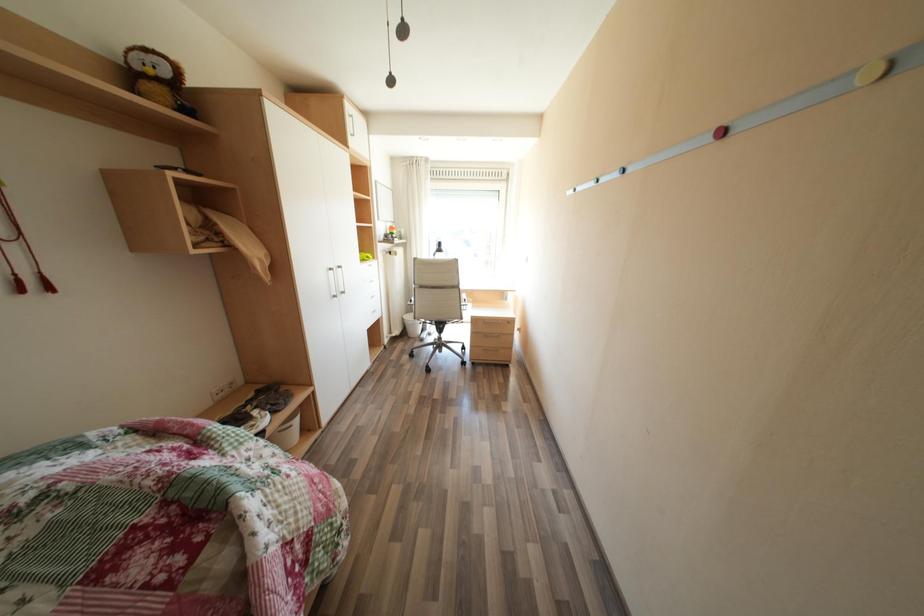
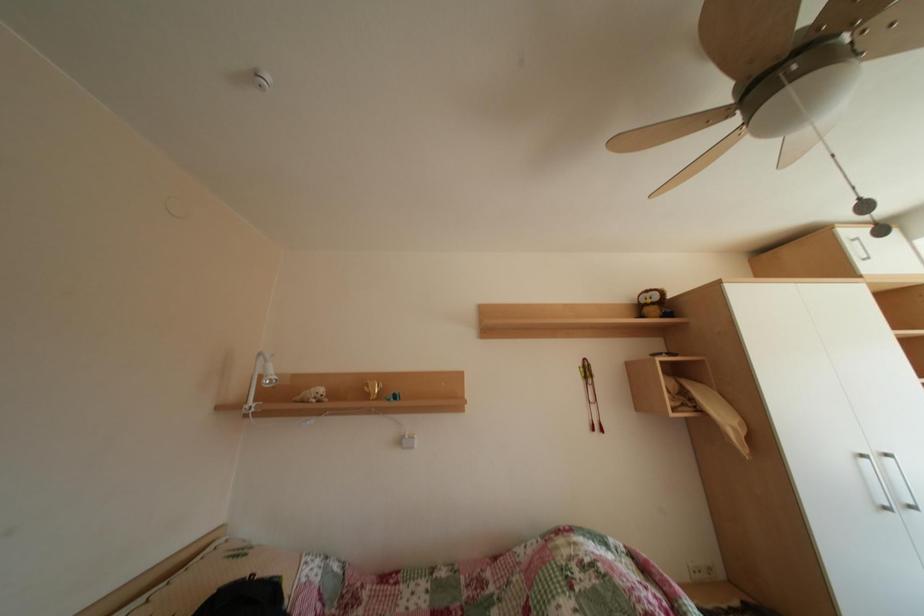
First-person continuous shooting, in which direction is the camera rotating?

The rotation direction of the camera is left-up.